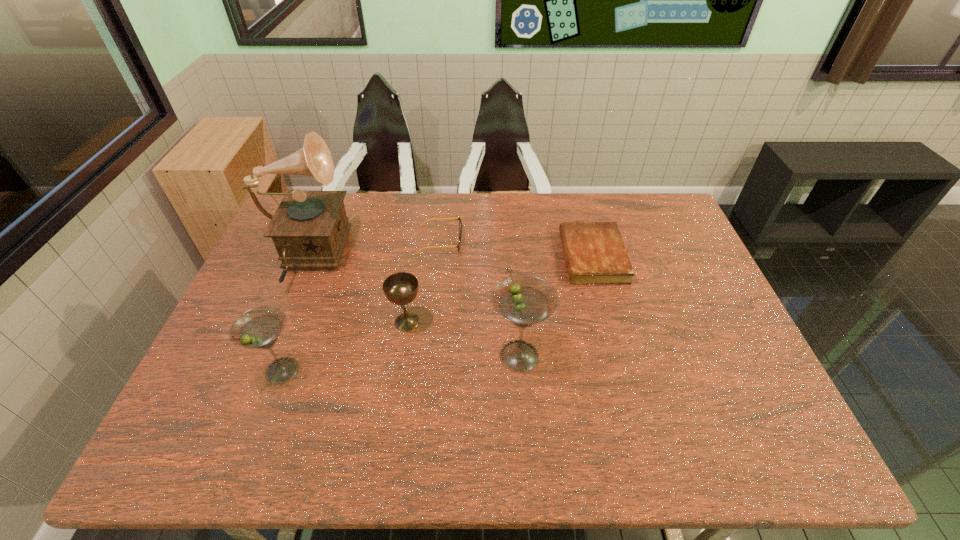
The height and width of the screenshot is (540, 960). Identify the location of free spot between the rightmost object and the spectacles. (516, 248).

You are a GUI agent. You are given a task and a screenshot of the screen. Output one action in this format:
    pyautogui.click(x=<x>, y=<y>)
    Task: Click on the empty space between the right martini and the tallest object
    The image size is (960, 540).
    Given the screenshot: What is the action you would take?
    pyautogui.click(x=412, y=307)

This screenshot has height=540, width=960. Find the location of `vacant point located between the record player and the chalice`. vacant point located between the record player and the chalice is located at coordinates (356, 291).

This screenshot has height=540, width=960. In order to click on empty space between the tallest object and the left martini in this screenshot , I will do `click(294, 315)`.

This screenshot has width=960, height=540. What are the coordinates of `free space between the left martini and the record player` in the screenshot? It's located at (294, 315).

Where is `vacant point located between the taller martini and the fourth tallest object`? Image resolution: width=960 pixels, height=540 pixels. vacant point located between the taller martini and the fourth tallest object is located at coordinates (463, 339).

Image resolution: width=960 pixels, height=540 pixels. I want to click on vacant region between the fourth tallest object and the record player, so click(x=356, y=291).

Find the location of a particular element. This screenshot has height=540, width=960. the fifth closest object to the fourth tallest object is located at coordinates (595, 253).

You are a GUI agent. You are given a task and a screenshot of the screen. Output one action in this format:
    pyautogui.click(x=<x>, y=<y>)
    Task: Click on the object that is the second nearest to the spectacles
    
    Given the screenshot: What is the action you would take?
    pyautogui.click(x=401, y=288)

Locate an element on the screen. free space that satisfies the following two spatial constraints: 1. on the spine side of the Bible; 2. on the front side of the taller martini is located at coordinates (619, 356).